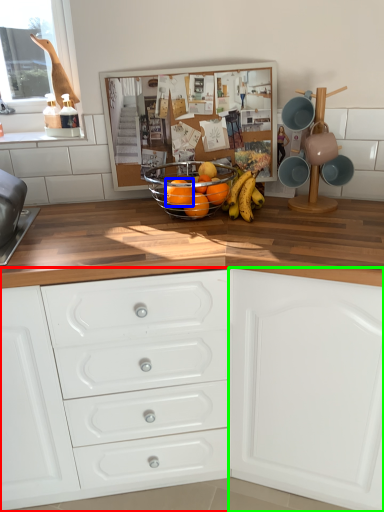
Question: Based on their relative distances, which object is farther from chest of drawers (highlighted by a red box)? Choose from orange (highlighted by a blue box) and cabinetry (highlighted by a green box).

Choices:
 (A) orange
 (B) cabinetry

Answer: (A)